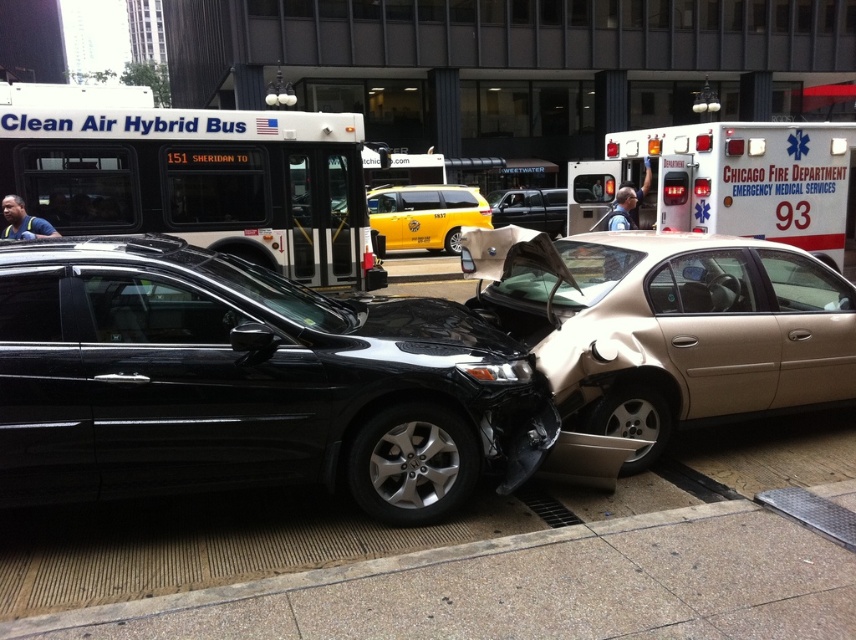
Is white/smooth ambulance at right to the right of yellow matte taxi at center from the viewer's perspective?

Correct, you'll find white/smooth ambulance at right to the right of yellow matte taxi at center.

Between white/smooth ambulance at right and yellow matte taxi at center, which one appears on the left side from the viewer's perspective?

Positioned to the left is yellow matte taxi at center.

Describe the element at coordinates (729, 180) in the screenshot. I see `white/smooth ambulance at right` at that location.

At what (x,y) coordinates should I click in order to perform the action: click on white/smooth ambulance at right. Please return your answer as a coordinate pair (x, y). Image resolution: width=856 pixels, height=640 pixels. Looking at the image, I should click on (729, 180).

Does point (82, 224) come in front of point (842, 186)?

Yes, it is.

Between white matte bus at upper left and white/smooth ambulance at right, which one appears on the left side from the viewer's perspective?

white matte bus at upper left is more to the left.

Who is more distant from viewer, (278, 204) or (687, 205)?

Point (278, 204)

The image size is (856, 640). What are the coordinates of `white matte bus at upper left` in the screenshot? It's located at (193, 177).

What do you see at coordinates (247, 384) in the screenshot?
I see `glossy black sedan at center` at bounding box center [247, 384].

Is glossy black sedan at center to the right of yellow matte taxi at center from the viewer's perspective?

Incorrect, glossy black sedan at center is not on the right side of yellow matte taxi at center.

Is point (33, 305) farther from camera compared to point (489, 212)?

No, it is in front of (489, 212).

Locate an element on the screen. glossy black sedan at center is located at coordinates (247, 384).